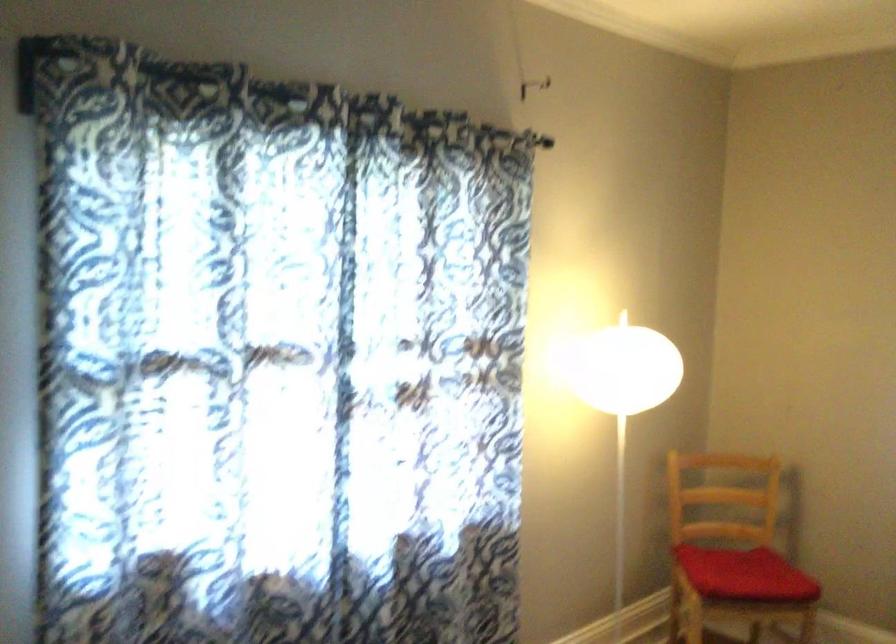
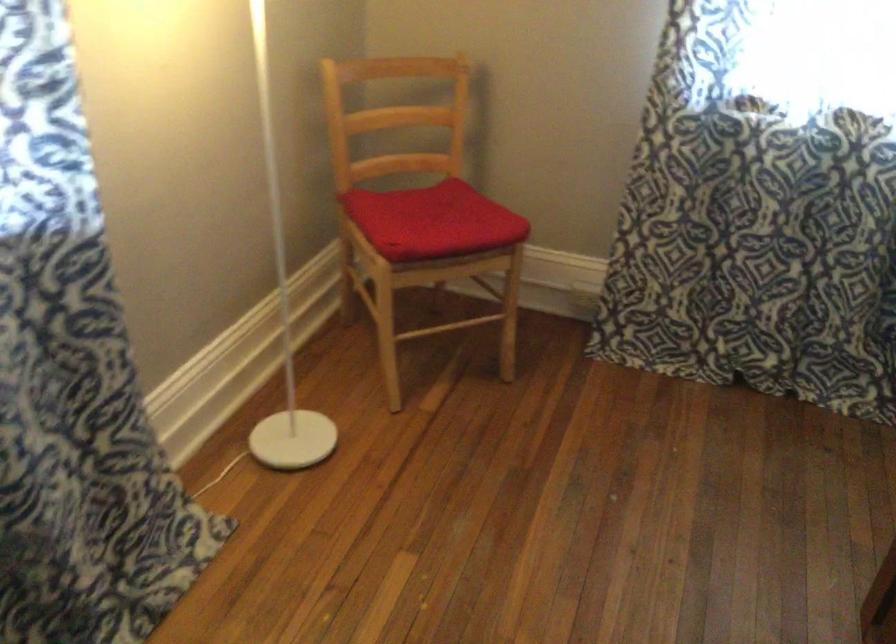
The images are taken continuously from a first-person perspective. In which direction is your viewpoint rotating?

The rotation direction of the camera is right-down.